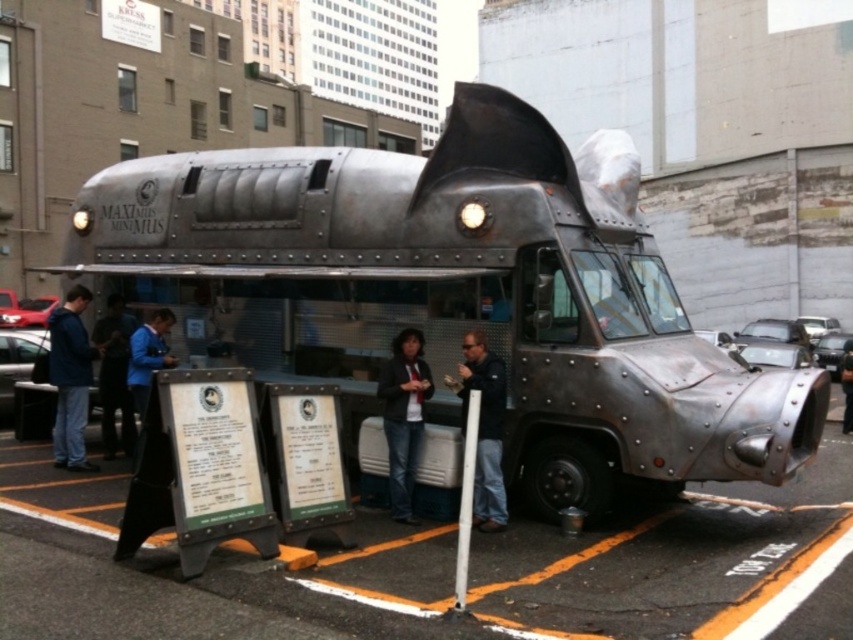
Based on the photo, who is more forward, (119, 394) or (135, 388)?

Point (135, 388) is more forward.

Is dark blue jacket at center closer to camera compared to blue fabric jacket at center?

No.

Does point (113, 339) come behind point (154, 321)?

Yes, point (113, 339) is behind point (154, 321).

Locate an element on the screen. dark blue jacket at center is located at coordinates 114,378.

You are a GUI agent. You are given a task and a screenshot of the screen. Output one action in this format:
    pyautogui.click(x=<x>, y=<y>)
    Task: Click on the blue denim jacket at left
    The width and height of the screenshot is (853, 640).
    Given the screenshot: What is the action you would take?
    pyautogui.click(x=71, y=380)

Who is shorter, blue denim jacket at left or dark blue jacket at center?

blue denim jacket at left

Between point (68, 426) and point (125, 390), which one is positioned behind?

Point (125, 390)

At what (x,y) coordinates should I click in order to perform the action: click on blue denim jacket at left. Please return your answer as a coordinate pair (x, y). Looking at the image, I should click on (71, 380).

Does white plastic pole at lower center have a lesser width compared to metallic helmet at center?

Correct, white plastic pole at lower center's width is less than metallic helmet at center's.

Does point (466, 508) come farther from viewer compared to point (848, 340)?

No.

This screenshot has height=640, width=853. I want to click on white plastic pole at lower center, so click(465, 500).